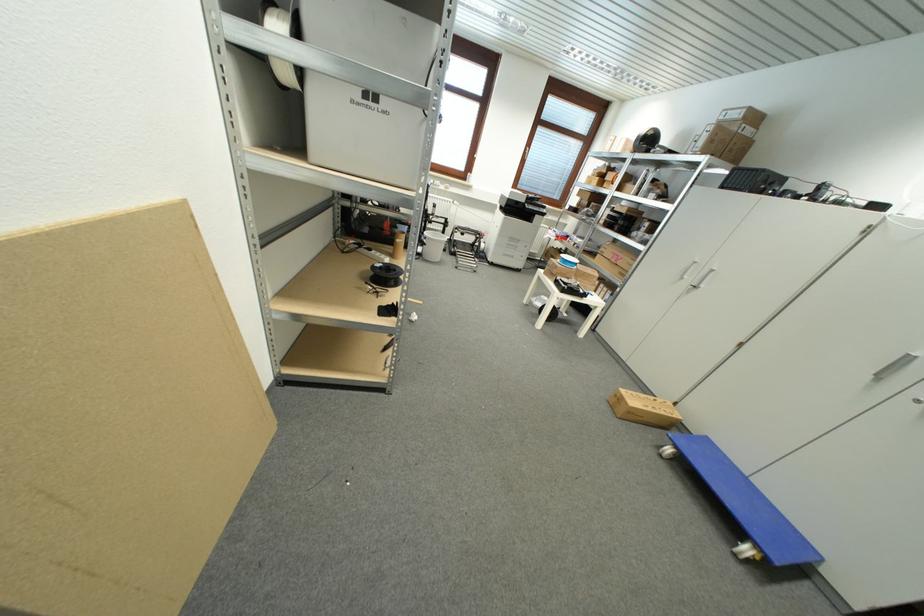
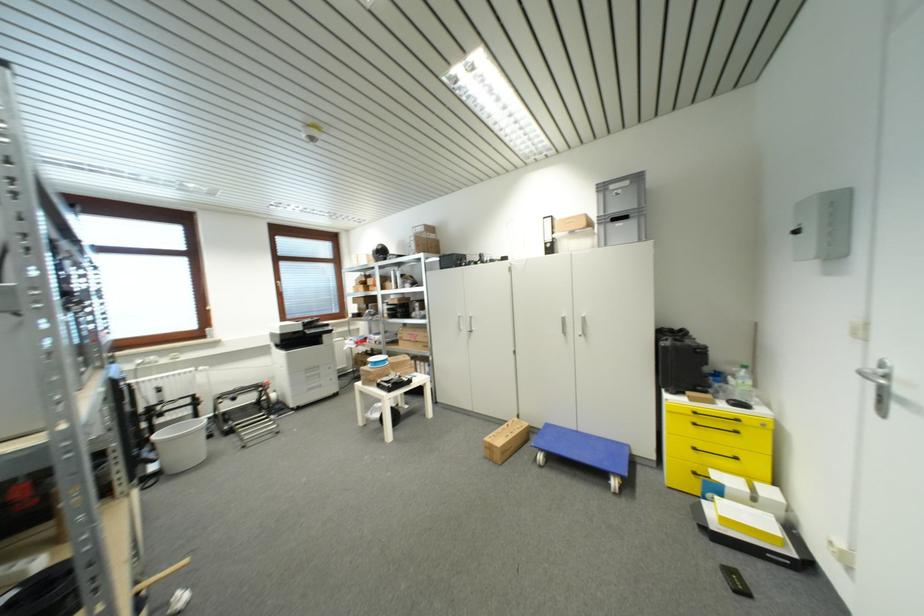
Where in the second image is the point corresponding to (x=663, y=402) from the first image?

(514, 426)